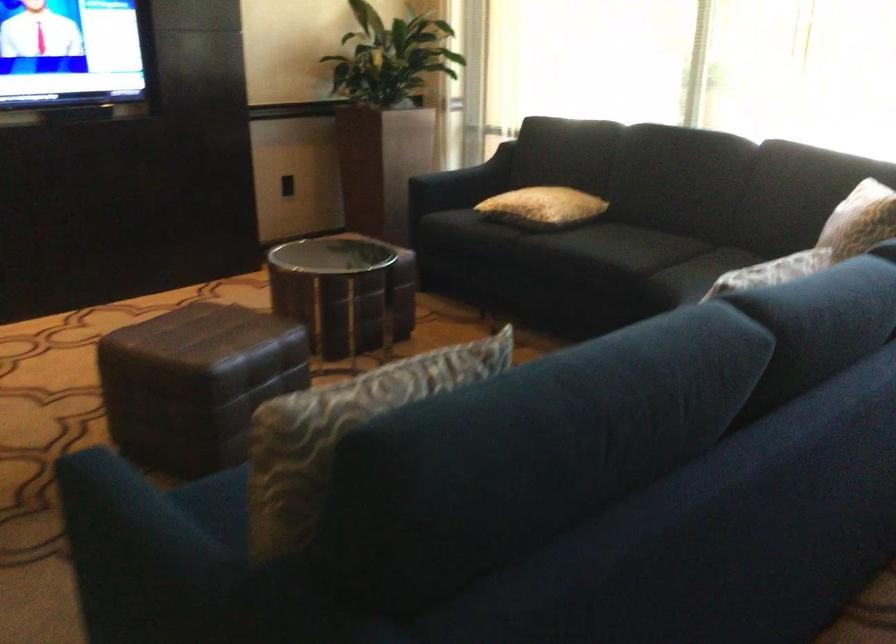
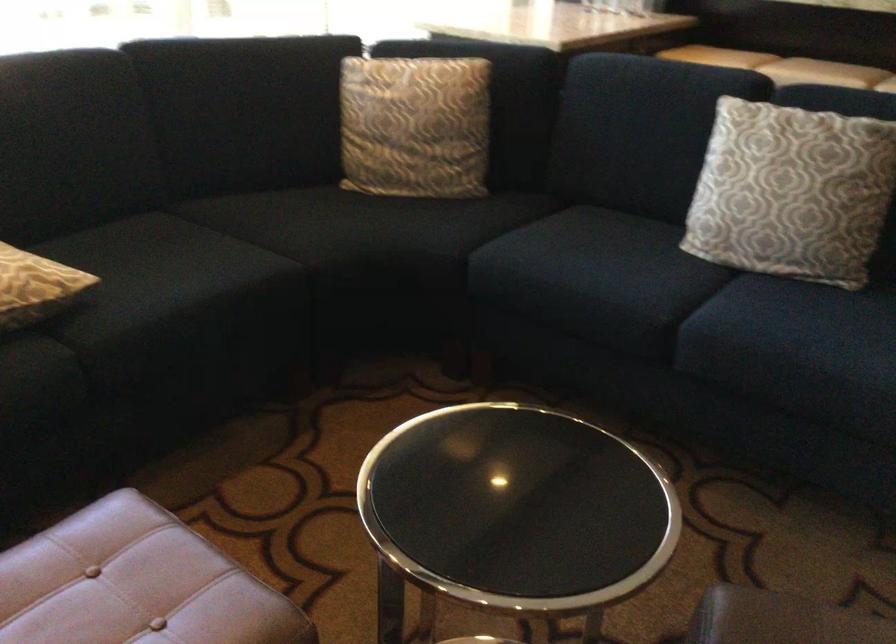
In the second image, find the point that corresponds to pixel 788 194 in the first image.

(238, 111)